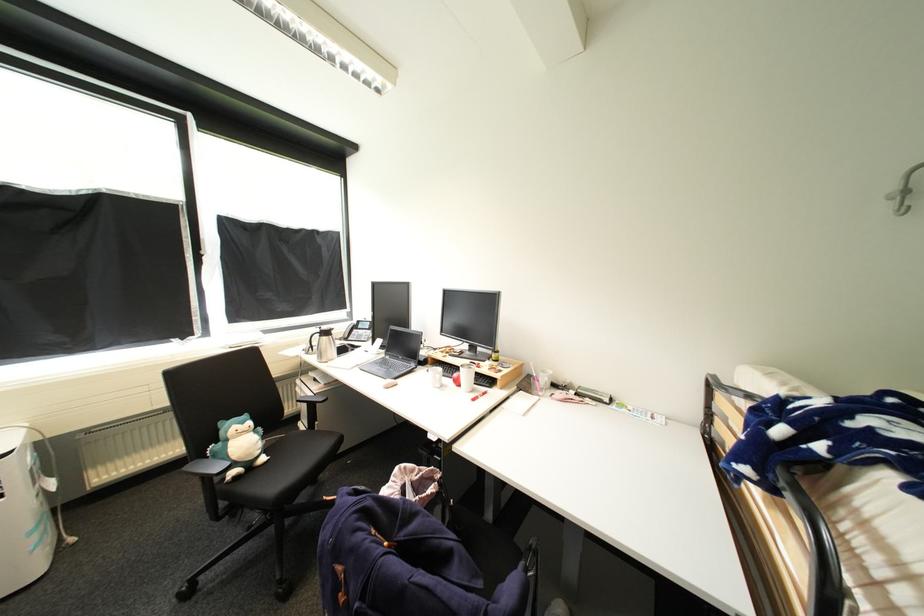
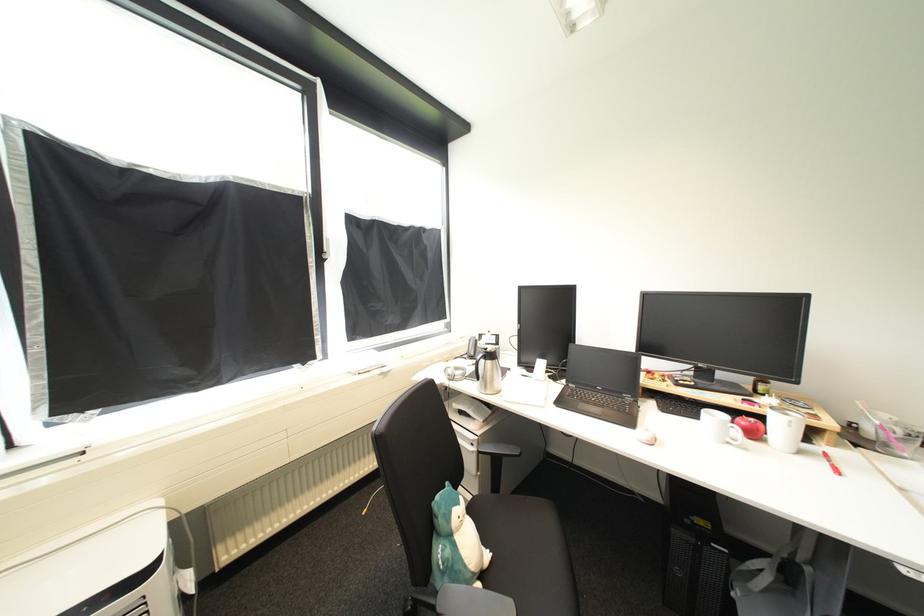
Locate, in the second image, the point that corresponds to the point at 445,389 in the first image.

(736, 445)